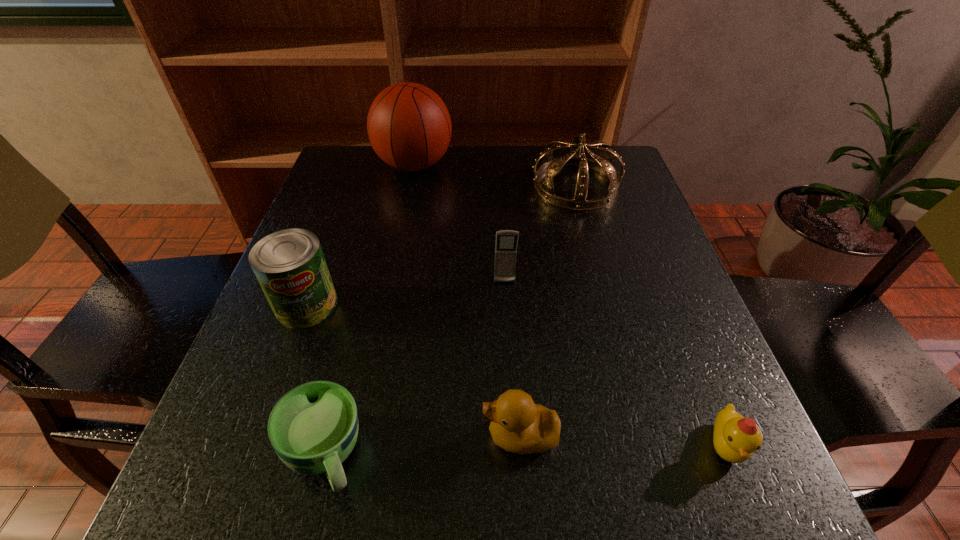
The width and height of the screenshot is (960, 540). I want to click on vacant space at the right edge, so click(x=604, y=259).

In the image, there is a desktop. Where is `vacant area at the far left corner`? Image resolution: width=960 pixels, height=540 pixels. vacant area at the far left corner is located at coordinates click(x=341, y=179).

This screenshot has width=960, height=540. In order to click on vacant area at the far right corner in this screenshot , I will do `click(626, 182)`.

At what (x,y) coordinates should I click in order to perform the action: click on free spot at the near right corner of the desktop. Please return your answer as a coordinate pair (x, y). This screenshot has height=540, width=960. Looking at the image, I should click on (757, 518).

Locate an element on the screen. free space that is in between the left duckling and the cup is located at coordinates (422, 445).

Where is `vacant space that's between the can and the cellular telephone`? The width and height of the screenshot is (960, 540). vacant space that's between the can and the cellular telephone is located at coordinates (406, 294).

In order to click on free spot between the left duckling and the tiara in this screenshot , I will do `click(548, 311)`.

The image size is (960, 540). I want to click on vacant point located between the left duckling and the cellular telephone, so click(x=513, y=360).

Image resolution: width=960 pixels, height=540 pixels. I want to click on free area in between the basketball and the cellular telephone, so click(460, 224).

The image size is (960, 540). I want to click on free space between the cellular telephone and the basketball, so click(460, 224).